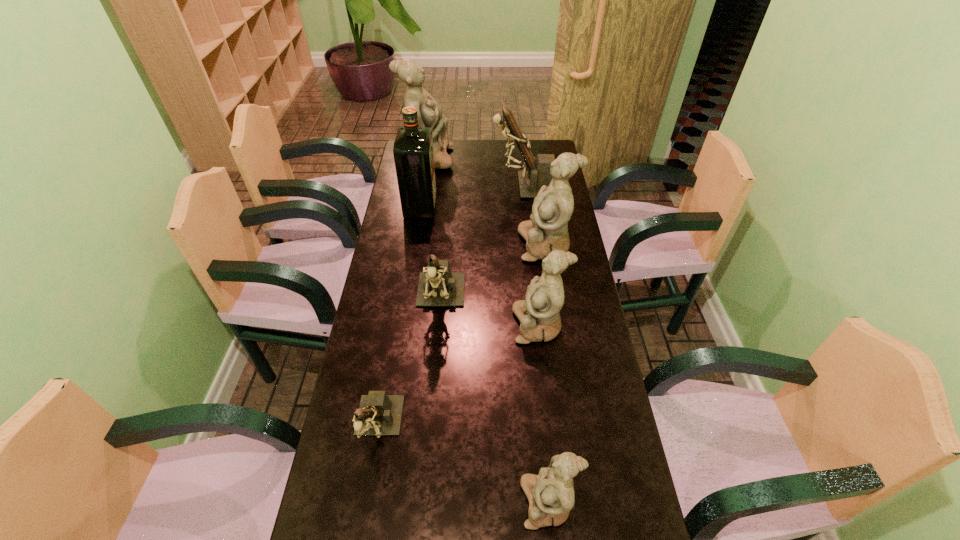
At what (x,y) coordinates should I click in order to perform the action: click on figurine that stands as the closest to the biggest brown figurine. Please return your answer as a coordinate pair (x, y). This screenshot has width=960, height=540. Looking at the image, I should click on (429, 112).

Locate an element on the screen. the sixth closest figurine to the nearest figurine is located at coordinates (429, 112).

This screenshot has height=540, width=960. I want to click on white figurine that is the third closest to the nearest figurine, so click(x=429, y=112).

Locate an element on the screen. the third closest white figurine to the smallest white figurine is located at coordinates (429, 112).

What are the coordinates of `brown figurine that is the third closest to the biggest white figurine` in the screenshot? It's located at (379, 414).

Identify which brown figurine is located as the second nearest to the second smallest brown figurine. Please provide its 2D coordinates. Your answer should be formatted as a tuple, i.e. [(x, y)], where the tuple contains the x and y coordinates of a point satisfying the conditions above.

[(530, 182)]

Locate an element on the screen. The width and height of the screenshot is (960, 540). free region that satisfies the following two spatial constraints: 1. on the front-facing side of the farthest object; 2. on the front-facing side of the seventh farthest object is located at coordinates (386, 428).

At what (x,y) coordinates should I click in order to perform the action: click on vacant area in the image that satisfies the following two spatial constraints: 1. on the front label of the liquor; 2. on the front-facing side of the sixth farthest figurine. Please return your answer as a coordinate pair (x, y). Image resolution: width=960 pixels, height=540 pixels. Looking at the image, I should click on (386, 428).